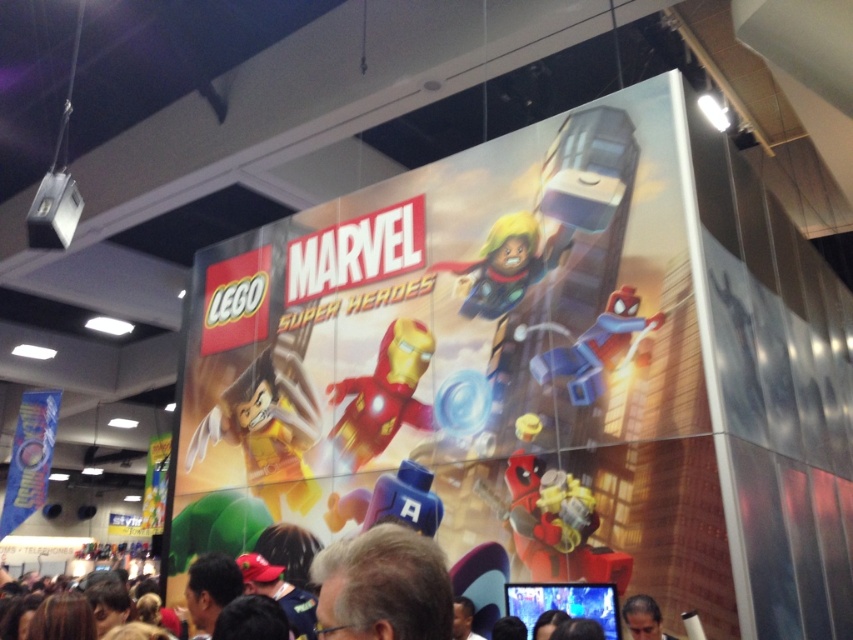
Looking at this image, does gray hair at center appear over matte red plastic deadpool at center?

Yes, gray hair at center is above matte red plastic deadpool at center.

Can you confirm if gray hair at center is positioned below matte red plastic deadpool at center?

No, gray hair at center is not below matte red plastic deadpool at center.

Which is in front, point (416, 554) or point (566, 561)?

Point (416, 554)

Where is `gray hair at center`? The height and width of the screenshot is (640, 853). gray hair at center is located at coordinates (383, 588).

Does matte red plastic deadpool at center appear on the left side of blue plastic head at center?

Incorrect, matte red plastic deadpool at center is not on the left side of blue plastic head at center.

Can you confirm if matte red plastic deadpool at center is wider than blue plastic head at center?

In fact, matte red plastic deadpool at center might be narrower than blue plastic head at center.

Between point (567, 573) and point (405, 502), which one is positioned in front?

Point (567, 573) is more forward.

This screenshot has height=640, width=853. Identify the location of matte red plastic deadpool at center. (555, 525).

Is point (434, 624) positioned before point (633, 609)?

Yes, point (434, 624) is in front of point (633, 609).

Is point (601, 611) farther from camera compared to point (650, 632)?

Yes, point (601, 611) is farther from viewer.

Is point (297, 602) farther from camera compared to point (640, 596)?

No, (297, 602) is closer to viewer.

Identify the location of brown hair at lower center. The width and height of the screenshot is (853, 640). (584, 602).